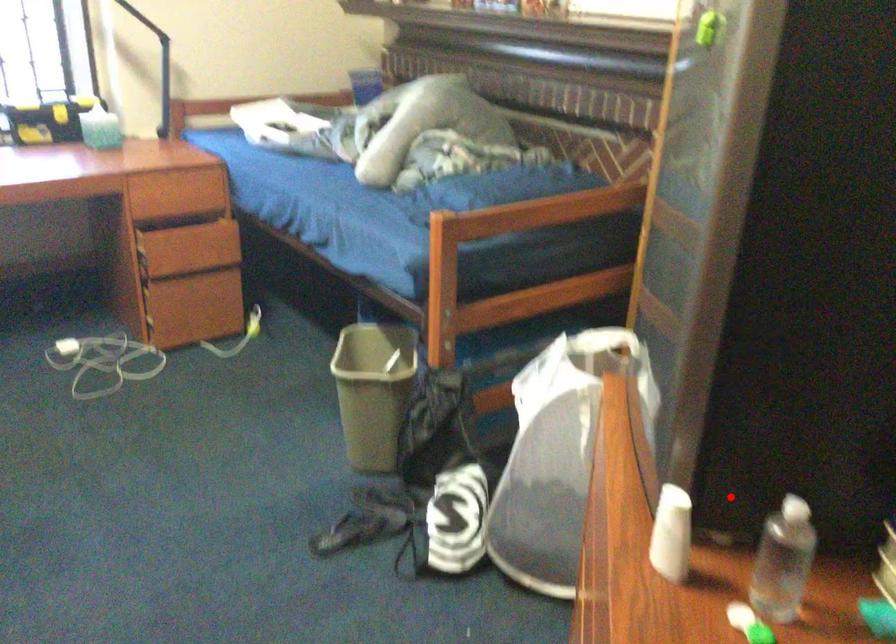
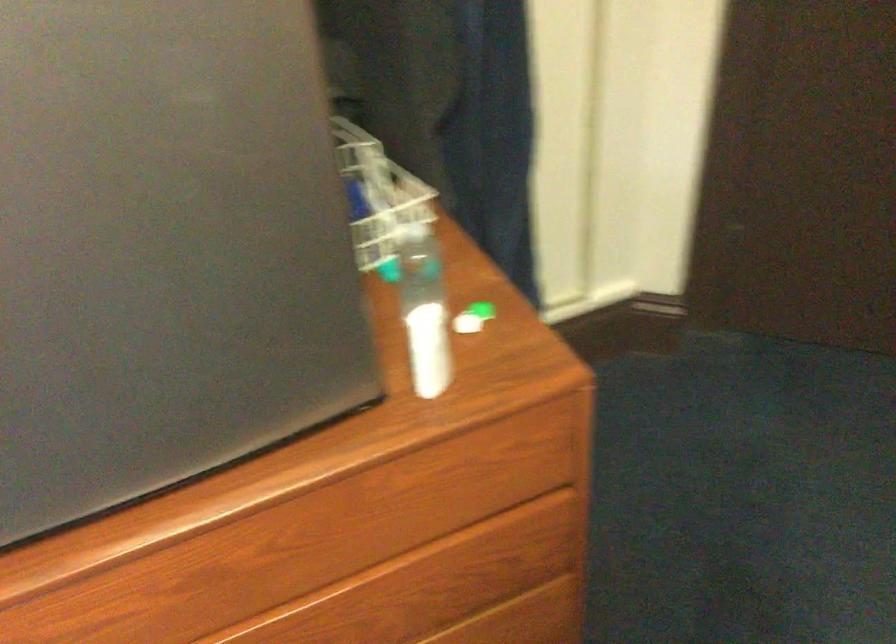
Where in the second image is the point corresponding to the highlighted location from the first image?

(424, 310)